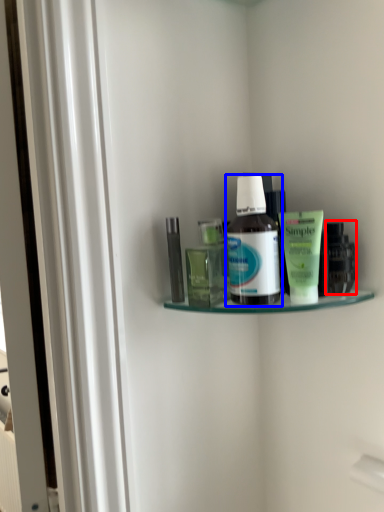
Question: Which point is further to the camera, toiletry (highlighted by a red box) or bottle (highlighted by a blue box)?

Choices:
 (A) toiletry
 (B) bottle

Answer: (A)